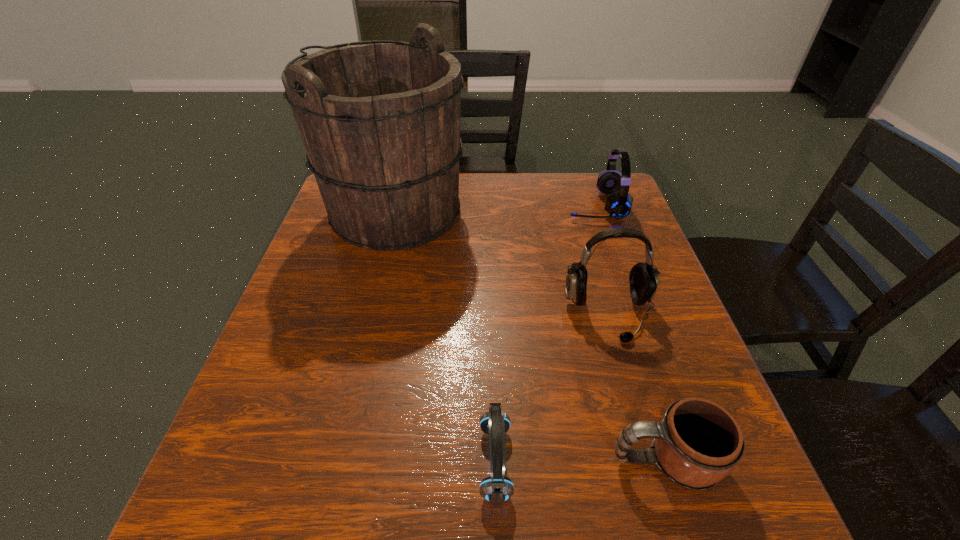
This screenshot has height=540, width=960. Identify the location of bucket located at the far edge. (380, 120).

Identify the location of headset present at the far edge. (618, 204).

This screenshot has width=960, height=540. Find the location of `mug that is at the near edge`. mug that is at the near edge is located at coordinates (697, 443).

Locate an element on the screen. headset situated at the near edge is located at coordinates (496, 489).

At what (x,y) coordinates should I click in order to perform the action: click on object situated at the left edge. Please return your answer as a coordinate pair (x, y). This screenshot has width=960, height=540. Looking at the image, I should click on (380, 120).

Image resolution: width=960 pixels, height=540 pixels. I want to click on mug located in the right edge section of the desktop, so click(697, 443).

Identify the location of object that is at the far left corner. This screenshot has height=540, width=960. (380, 120).

Where is `object at the far right corner`? The image size is (960, 540). object at the far right corner is located at coordinates (618, 204).

Image resolution: width=960 pixels, height=540 pixels. I want to click on object present at the near right corner, so click(x=697, y=443).

Image resolution: width=960 pixels, height=540 pixels. Find the location of `free spot at the far edge of the desktop`. free spot at the far edge of the desktop is located at coordinates (533, 187).